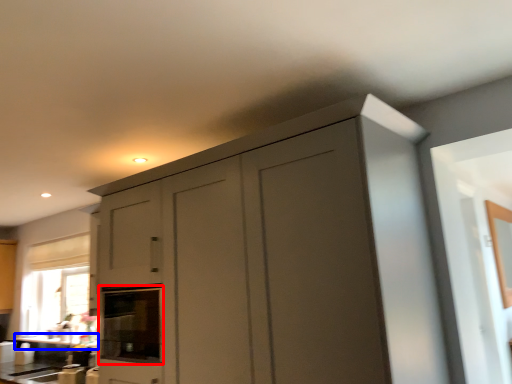
Question: Among these objects, which one is farthest to the camera, oven (highlighted by a red box) or counter top (highlighted by a blue box)?

Choices:
 (A) oven
 (B) counter top

Answer: (B)